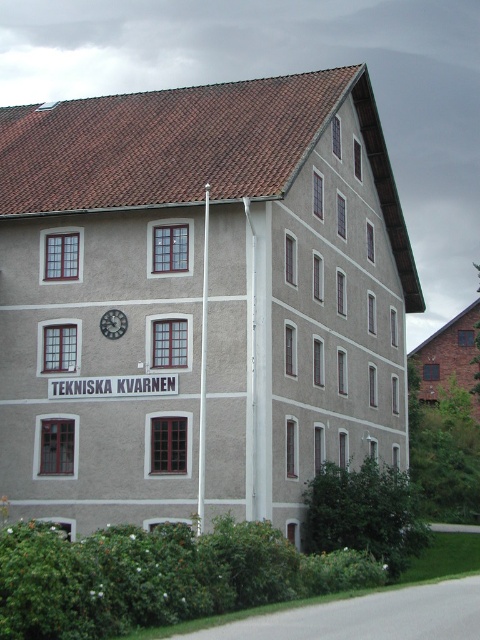
The width and height of the screenshot is (480, 640). Find the location of `white plastic pole at center`. white plastic pole at center is located at coordinates (203, 369).

Can you confirm if white plastic pole at center is wider than metallic clock at center?

No, white plastic pole at center is not wider than metallic clock at center.

Is point (202, 314) in front of point (109, 321)?

Yes, point (202, 314) is in front of point (109, 321).

Image resolution: width=480 pixels, height=640 pixels. Find the location of `white plastic pole at center`. white plastic pole at center is located at coordinates (203, 369).